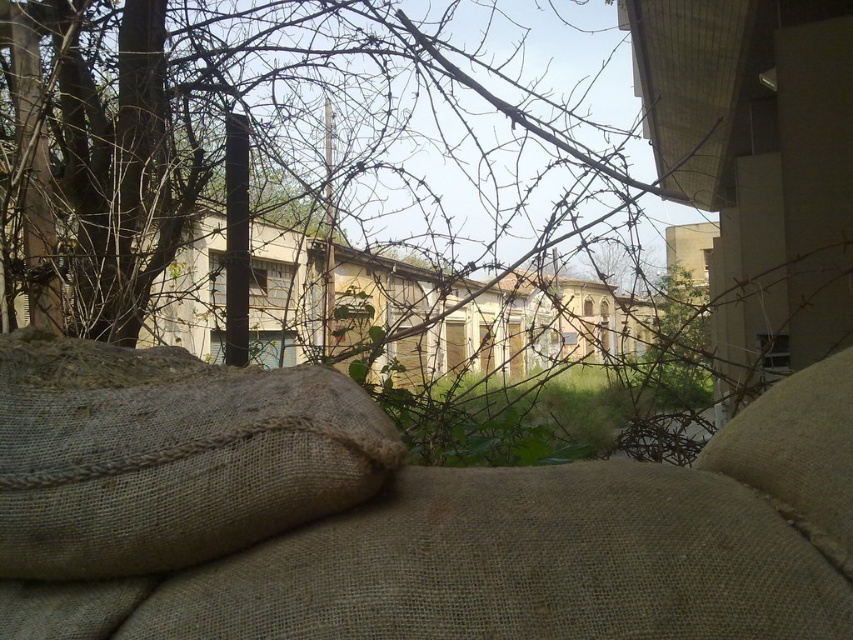
You are a photographer trying to capture a clear shot of the brown rough tree at upper left and the burlap sack at lower left. Since the barbed wire is in the way, you decide to move to the right. Will moving to the right help you get both objects in the frame without the barbed wire blocking them?

Moving to the right will position you so the brown rough tree at upper left is now to the right of the burlap sack at lower left, but since the barbed wire is in the foreground, moving right may still leave parts of both objects obscured by the barbed wire barrier.

You are an observer looking at the scene through the barbed wire. There is a brown rough tree at upper left and a burlap pillow at center. Which object is closer to you?

The brown rough tree at upper left is closer to you because the burlap pillow at center is behind it.

You are a photographer trying to capture the brown rough tree at upper left and the burlap sack at lower left in the same frame. Based on their positions, which object will appear higher in your photo?

The brown rough tree at upper left will appear higher in the photo since it is positioned above the burlap sack at lower left.